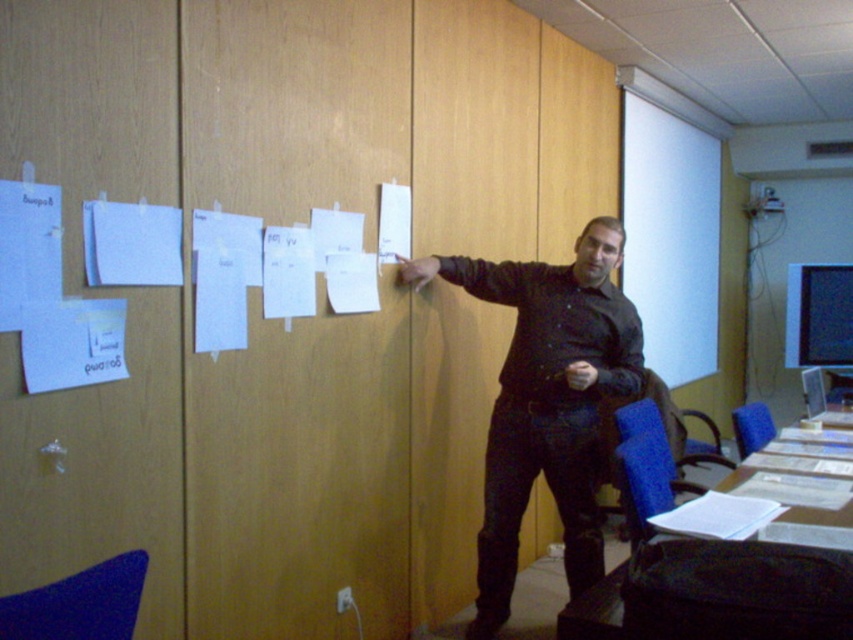
Is point (606, 248) closer to camera compared to point (653, 140)?

Yes, it is.

Which is more to the right, black matte shirt at center or white matte paper at upper center?

white matte paper at upper center

Between point (479, 624) and point (688, 298), which one is positioned behind?

The point (688, 298) is more distant.

Where is `black matte shirt at center`? The width and height of the screenshot is (853, 640). black matte shirt at center is located at coordinates (546, 401).